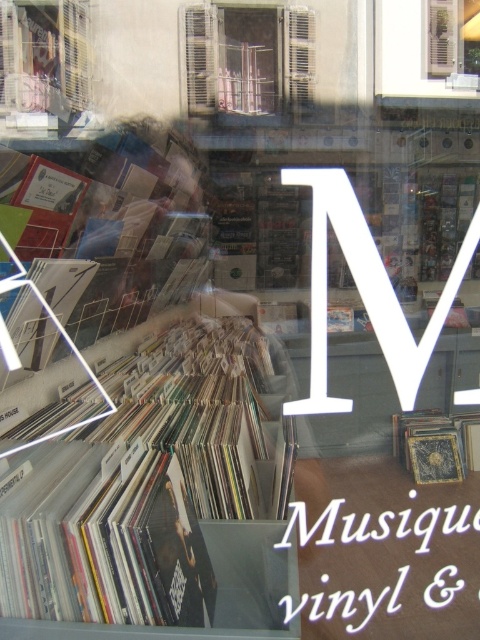
You are a customer looking at the window display of the record store. You notice the white matte vinyl records at center and the white wooden shutters at upper center. Which object is located below the other?

The white matte vinyl records at center are positioned below the white wooden shutters at upper center.

You are standing outside the record store looking through the window. There are two points marked on the window at coordinates point (283, 99) and point (453, 472). Which point is closer to you?

Point (283, 99) is closer to the viewer than point (453, 472).

You are a delivery person trying to place a new matte plastic window at upper left into the existing display. The new window is 1.05 meters wide. Can you fit it without overlapping the existing window?

The existing matte plastic window at upper left is 1.04 meters wide. The new window is 1.05 meters wide, which is slightly wider. Therefore, it cannot be placed without overlapping the existing window.